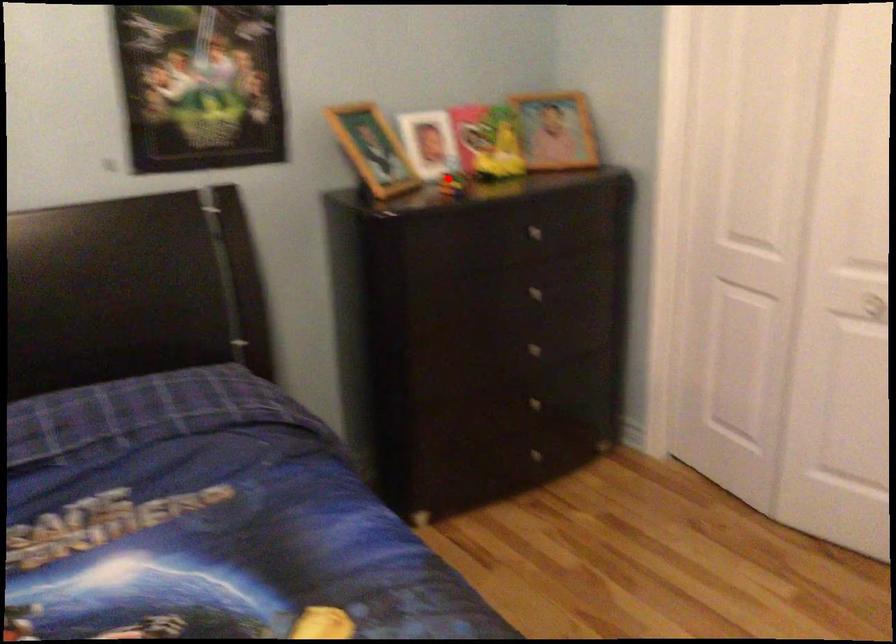
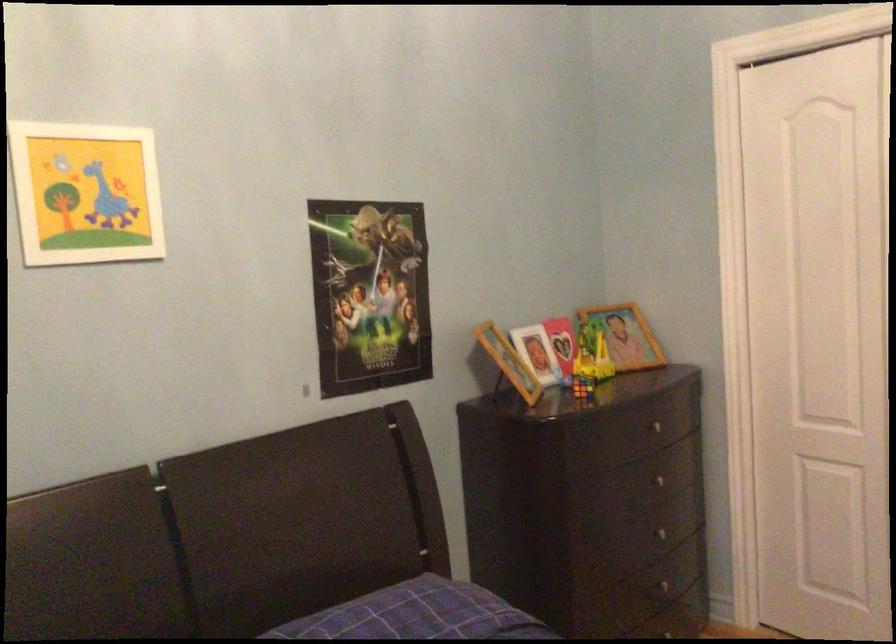
Question: A red point is marked in image1. In image2, is the corresponding 3D point closer to the camera or farther? Reply with the corresponding letter.

Choices:
 (A) The corresponding 3D point is closer.
 (B) The corresponding 3D point is farther.

Answer: (B)